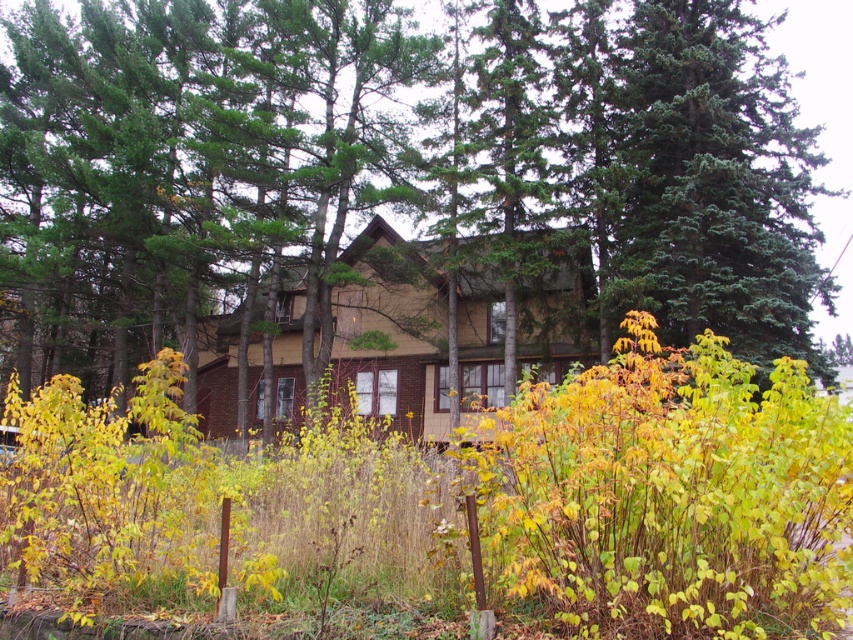
Is the position of green textured tree at center more distant than that of yellow-green leafy bush at center?

Yes.

Does point (117, 81) come farther from viewer compared to point (543, 419)?

Yes, it is.

Where is `green textured tree at center`? The width and height of the screenshot is (853, 640). green textured tree at center is located at coordinates (395, 157).